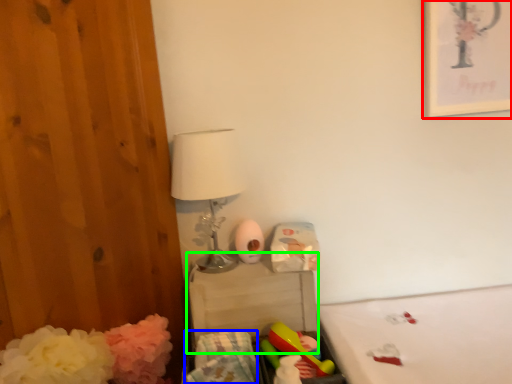
Question: Considering the real-world distances, which object is closest to picture frame (highlighted by a red box)? material (highlighted by a blue box) or changing table (highlighted by a green box).

Choices:
 (A) material
 (B) changing table

Answer: (B)